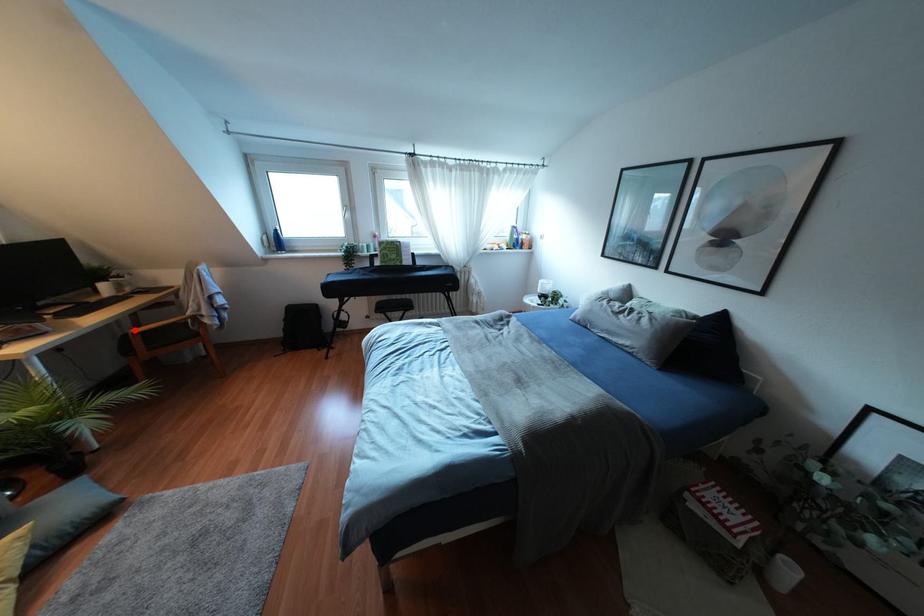
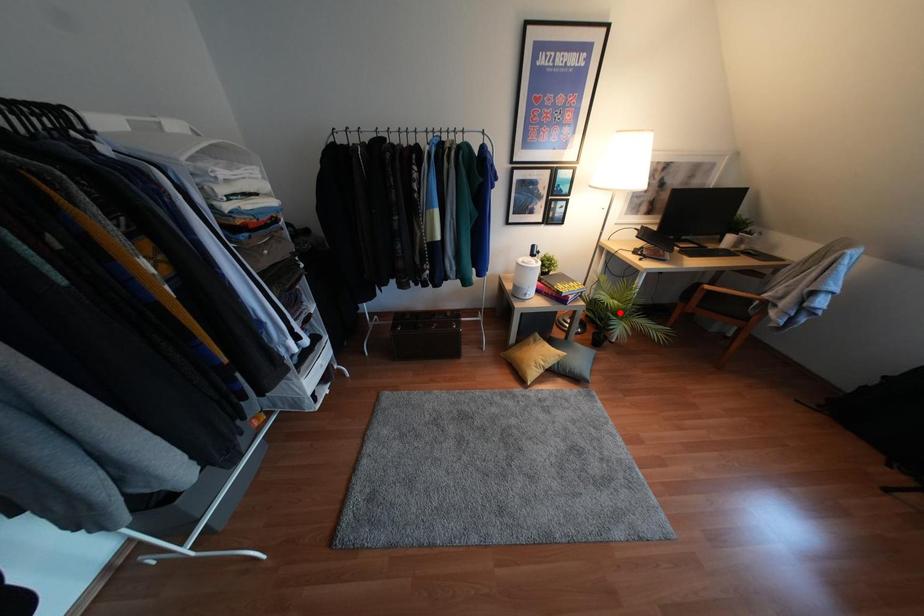
I am providing you with two images of the same scene from different viewpoints. A red point is marked on the first image and another point is marked on the second image. Do the highlighted points in image1 and image2 indicate the same real-world spot?

No